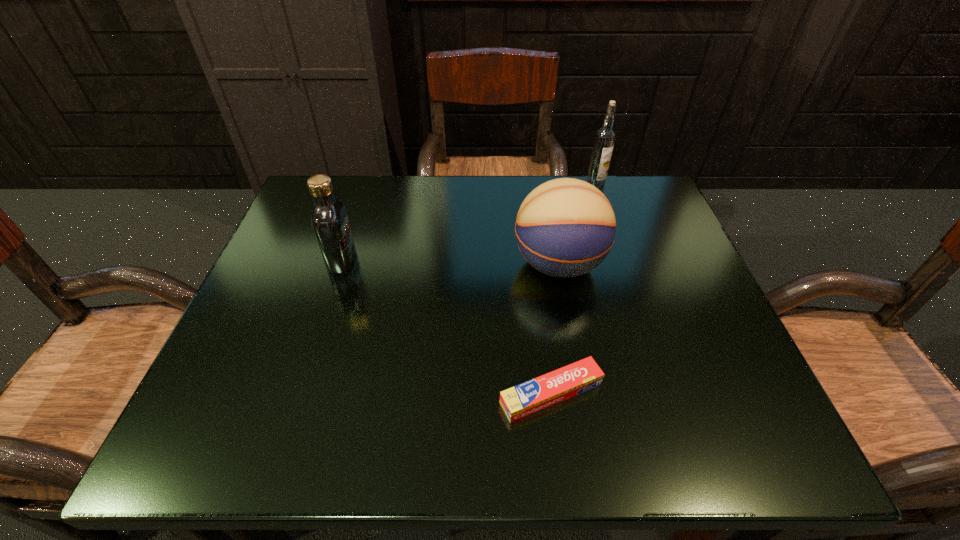
Locate an element on the screen. Image resolution: width=960 pixels, height=540 pixels. vacant space at the left edge is located at coordinates (300, 253).

Image resolution: width=960 pixels, height=540 pixels. In order to click on blank space at the right edge of the desktop in this screenshot , I will do `click(698, 336)`.

In the image, there is a desktop. Identify the location of vacant space at the far left corner. (297, 203).

Find the location of a particular element. The width and height of the screenshot is (960, 540). vacant area between the basketball and the toothpaste is located at coordinates (555, 329).

This screenshot has height=540, width=960. Identify the location of unoccupied position between the farther vodka and the shortest object. click(573, 289).

Image resolution: width=960 pixels, height=540 pixels. Identify the location of blank region between the left vodka and the basketball. (450, 262).

Where is `vacant point located between the left vodka and the farthest object`? Image resolution: width=960 pixels, height=540 pixels. vacant point located between the left vodka and the farthest object is located at coordinates (468, 222).

This screenshot has width=960, height=540. What are the coordinates of `vacant space that's between the basketball and the toothpaste` in the screenshot? It's located at (555, 329).

At what (x,y) coordinates should I click in order to perform the action: click on vacant area that lies between the basketball and the toothpaste. Please return your answer as a coordinate pair (x, y). Looking at the image, I should click on (555, 329).

What are the coordinates of `empty space that is in between the leftmost object and the basketball` in the screenshot? It's located at (450, 262).